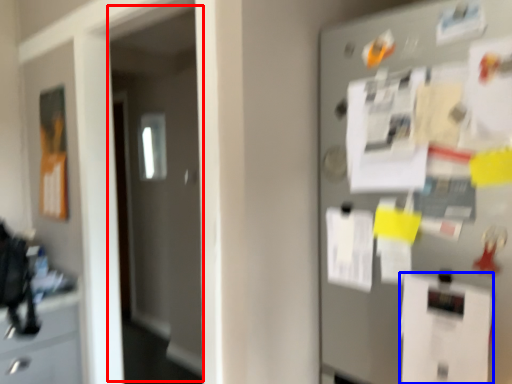
Question: Which point is closer to the camera, glass door (highlighted by a red box) or paper (highlighted by a blue box)?

Choices:
 (A) glass door
 (B) paper

Answer: (B)